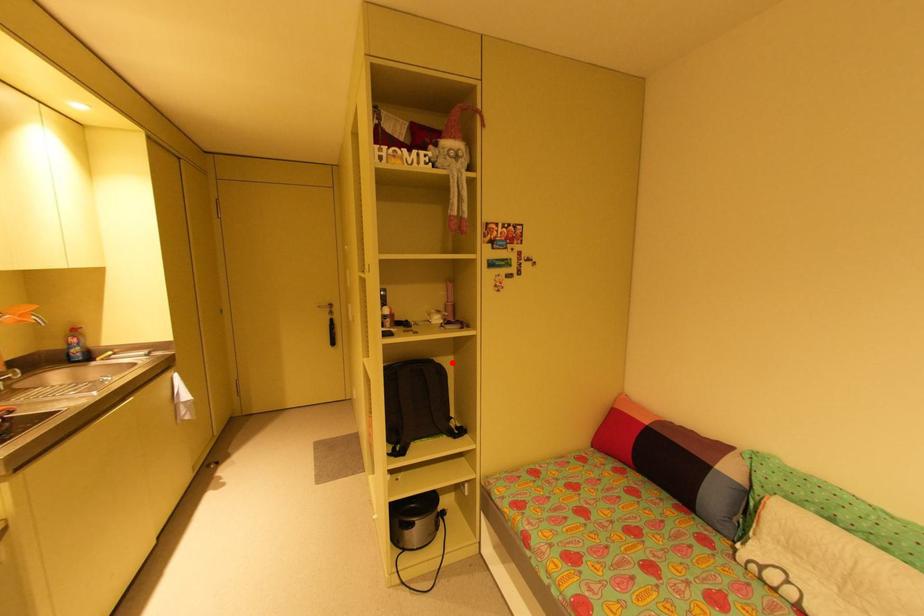
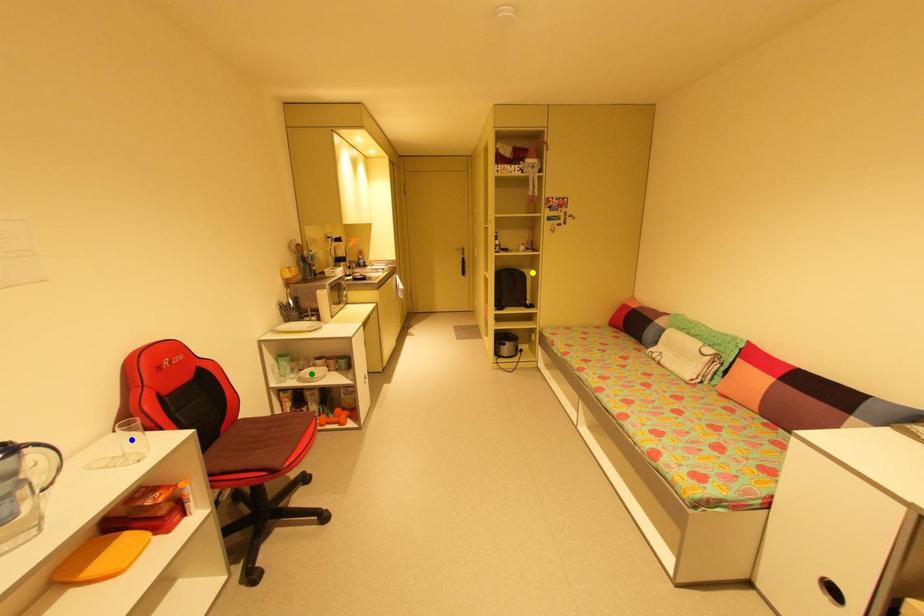
Question: I am providing you with two images of the same scene from different viewpoints. A red point is marked on the first image. You are given multiple points on the second image. Which spot in image 2 lines up with the point in image 1?

Choices:
 (A) blue point
 (B) yellow point
 (C) green point

Answer: (B)